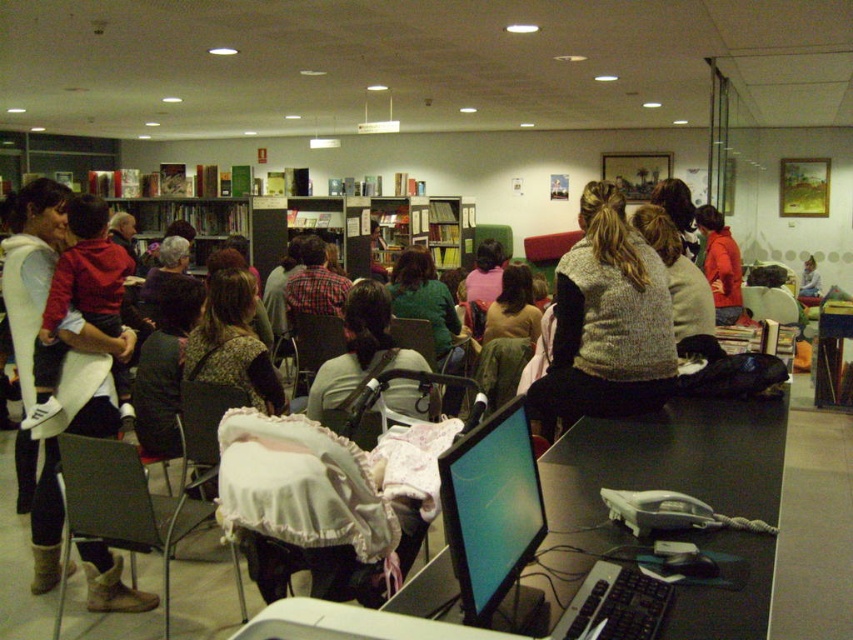
Question: Can you confirm if knitted gray sweater at center is positioned to the left of knitted beige sweater at center?

Choices:
 (A) yes
 (B) no

Answer: (A)

Question: From the image, what is the correct spatial relationship of knitted gray sweater at center in relation to matte black backpack at center?

Choices:
 (A) right
 (B) left

Answer: (A)

Question: Which point is farther from the camera taking this photo?

Choices:
 (A) [x=704, y=285]
 (B) [x=125, y=355]
 (C) [x=659, y=368]
 (D) [x=759, y=435]

Answer: (A)

Question: Does green sweater at center have a greater width compared to brown textured sweater at center?

Choices:
 (A) yes
 (B) no

Answer: (A)

Question: Estimate the real-world distances between objects in this image. Which object is closer to the white fleece jacket at left?

Choices:
 (A) green sweater at center
 (B) brown textured sweater at center
 (C) matte black backpack at center

Answer: (C)

Question: Which point appears farthest from the camera in this image?

Choices:
 (A) (611, 397)
 (B) (402, 305)
 (C) (97, 392)

Answer: (B)